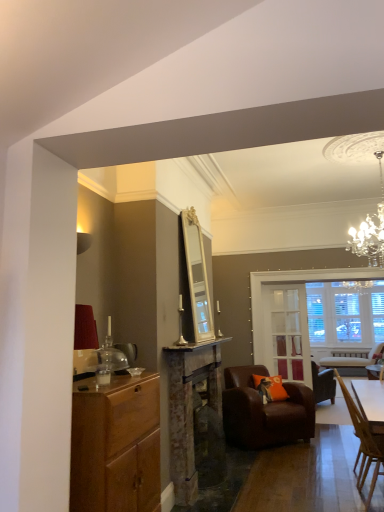
Question: Is wooden chair at lower right, which appears as the 1th chair when viewed from the front, completely or partially inside brown leather armchair at center, which is the second chair from front to back?

Choices:
 (A) no
 (B) yes

Answer: (A)

Question: Is there a large distance between brown leather armchair at center, which is the 1th chair in back-to-front order, and wooden chair at lower right, placed as the second chair when sorted from back to front?

Choices:
 (A) no
 (B) yes

Answer: (B)

Question: Does brown leather armchair at center, which is the 1th chair in back-to-front order, have a greater height compared to wooden chair at lower right, placed as the second chair when sorted from back to front?

Choices:
 (A) yes
 (B) no

Answer: (B)

Question: Does brown leather armchair at center, which is the second chair from front to back, have a lesser width compared to wooden chair at lower right, which appears as the 1th chair when viewed from the front?

Choices:
 (A) yes
 (B) no

Answer: (B)

Question: Is brown leather armchair at center, which is the second chair from front to back, closer to camera compared to wooden chair at lower right, placed as the second chair when sorted from back to front?

Choices:
 (A) yes
 (B) no

Answer: (B)

Question: In terms of size, does brown leather armchair at center, which is the second chair from front to back, appear bigger or smaller than wooden chair at lower right, which appears as the 1th chair when viewed from the front?

Choices:
 (A) big
 (B) small

Answer: (A)

Question: From a real-world perspective, relative to wooden chair at lower right, which appears as the 1th chair when viewed from the front, is brown leather armchair at center, which is the 1th chair in back-to-front order, vertically above or below?

Choices:
 (A) above
 (B) below

Answer: (B)

Question: Is point click(266, 414) closer or farther from the camera than point click(379, 450)?

Choices:
 (A) closer
 (B) farther

Answer: (B)

Question: In terms of width, does brown leather armchair at center, which is the second chair from front to back, look wider or thinner when compared to wooden chair at lower right, placed as the second chair when sorted from back to front?

Choices:
 (A) thin
 (B) wide

Answer: (B)

Question: From the image's perspective, is orange fabric pillow at center located above or below clear glass door at center?

Choices:
 (A) above
 (B) below

Answer: (B)

Question: Looking at their shapes, would you say orange fabric pillow at center is wider or thinner than clear glass door at center?

Choices:
 (A) thin
 (B) wide

Answer: (B)

Question: Is orange fabric pillow at center bigger or smaller than clear glass door at center?

Choices:
 (A) small
 (B) big

Answer: (B)

Question: From a real-world perspective, is orange fabric pillow at center positioned above or below clear glass door at center?

Choices:
 (A) above
 (B) below

Answer: (B)

Question: Looking at their shapes, would you say orange fabric pillow at center is wider or thinner than rusty metal fireplace at center?

Choices:
 (A) wide
 (B) thin

Answer: (A)

Question: From a real-world perspective, is orange fabric pillow at center above or below rusty metal fireplace at center?

Choices:
 (A) below
 (B) above

Answer: (A)